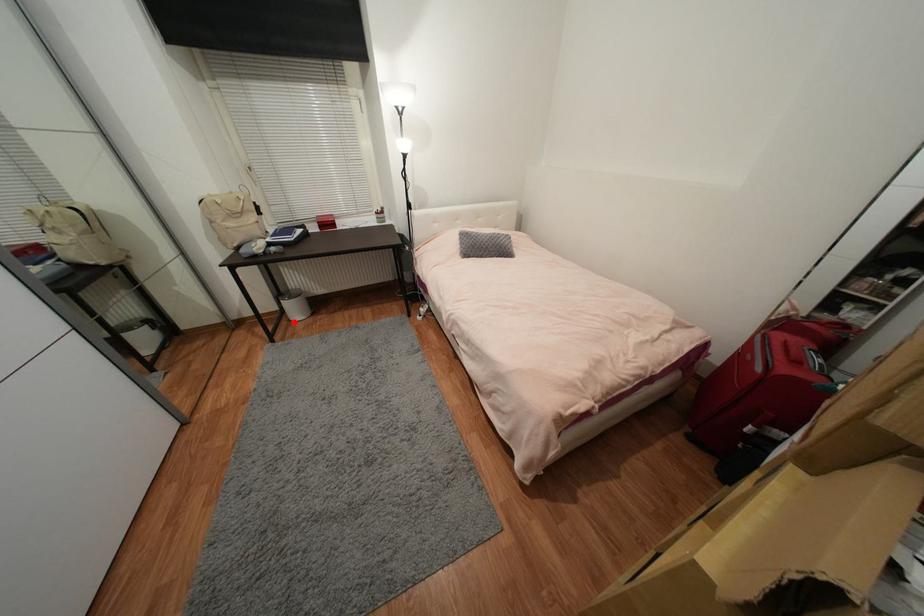
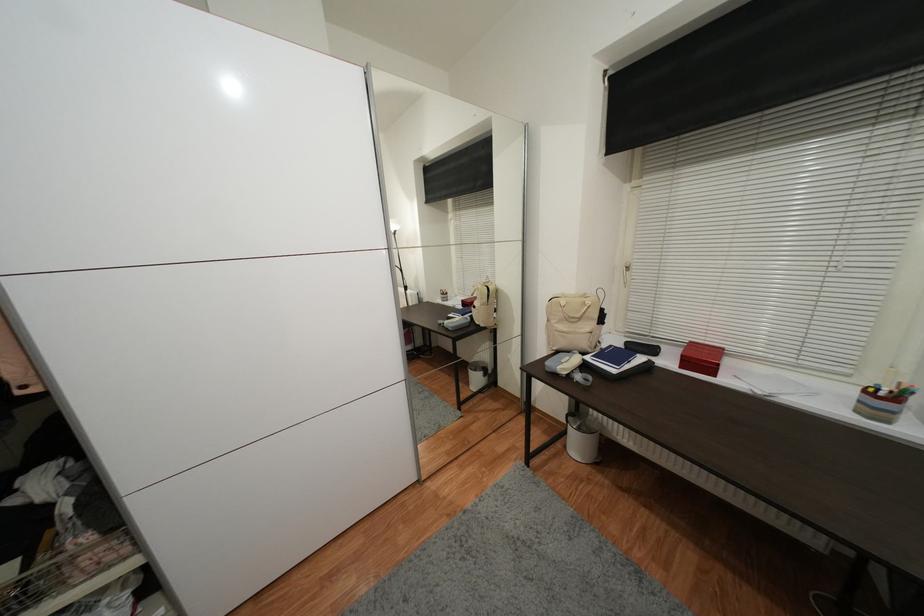
Question: I am providing you with two images of the same scene from different viewpoints. In image1, a red point is highlighted. Considering the same 3D point in image2, which of the following is correct?

Choices:
 (A) It is closer
 (B) It is farther

Answer: (B)